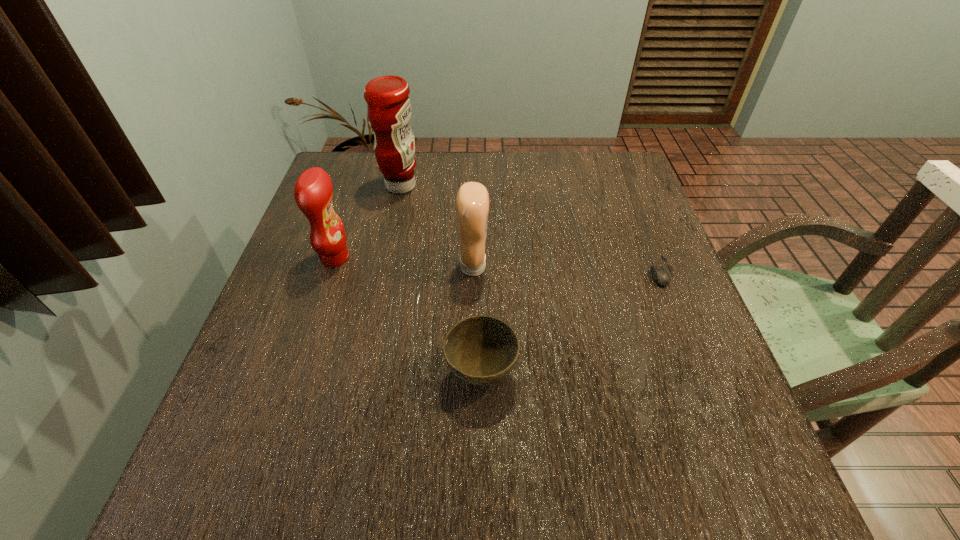
Find the location of a particular element. The width and height of the screenshot is (960, 540). vacant space situated on the label of the rightmost condiment is located at coordinates (660, 267).

The image size is (960, 540). Identify the location of vacant space located on the left of the bowl. (387, 373).

Locate an element on the screen. The height and width of the screenshot is (540, 960). vacant region located on the left of the shortest object is located at coordinates (611, 271).

Locate an element on the screen. object that is at the far edge is located at coordinates (388, 105).

Identify the location of object that is positioned at the left edge. Image resolution: width=960 pixels, height=540 pixels. (313, 191).

What are the coordinates of `object that is positioned at the right edge` in the screenshot? It's located at (660, 276).

Identify the location of vacant area at the far edge. This screenshot has width=960, height=540. (532, 184).

Locate an element on the screen. vacant space at the near edge is located at coordinates (567, 514).

In the image, there is a desktop. Identify the location of blank space at the left edge. The image size is (960, 540). (323, 269).

The height and width of the screenshot is (540, 960). Find the location of `vacant space at the right edge of the desktop`. vacant space at the right edge of the desktop is located at coordinates (636, 246).